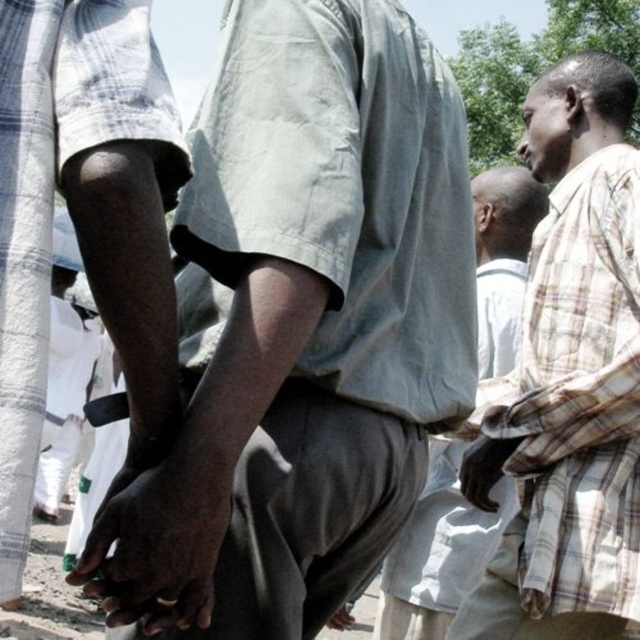
Question: Which is nearer to the plaid fabric shirt at right?

Choices:
 (A) light gray fabric pants at center
 (B) dark skin hand at center
 (C) light gray cotton shirt at center

Answer: (A)

Question: Which object is farther from the camera taking this photo?

Choices:
 (A) light gray fabric pants at center
 (B) dark skin hand at center
 (C) plaid fabric shirt at right

Answer: (A)

Question: Is plaid fabric shirt at right below light gray fabric pants at center?

Choices:
 (A) yes
 (B) no

Answer: (B)

Question: Can you confirm if light gray cotton shirt at center is wider than dark skin hand at center?

Choices:
 (A) no
 (B) yes

Answer: (B)

Question: Can you confirm if light gray cotton shirt at center is bigger than plaid fabric shirt at right?

Choices:
 (A) no
 (B) yes

Answer: (A)

Question: Which object is the farthest from the dark skin hand at center?

Choices:
 (A) light gray cotton shirt at center
 (B) plaid fabric shirt at right
 (C) light gray fabric pants at center

Answer: (C)